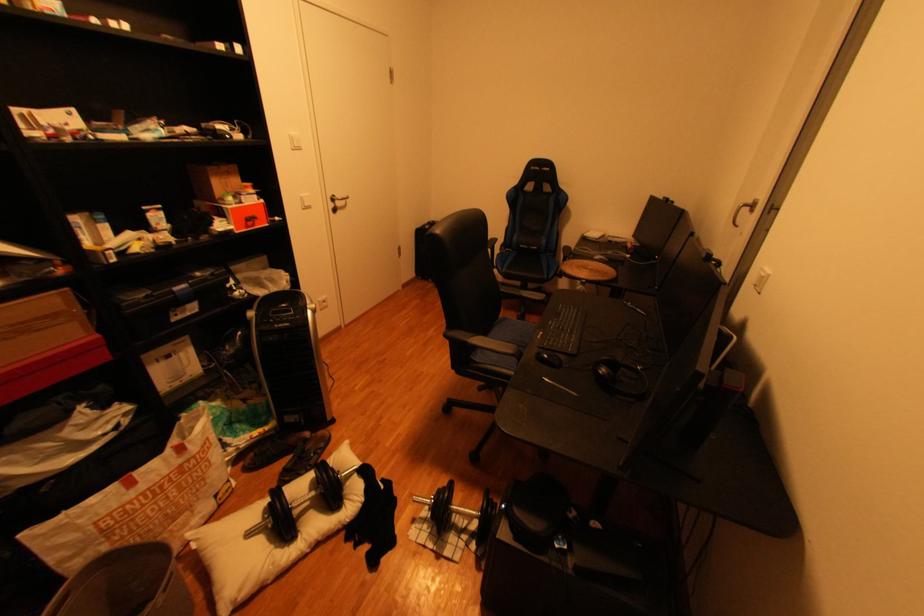
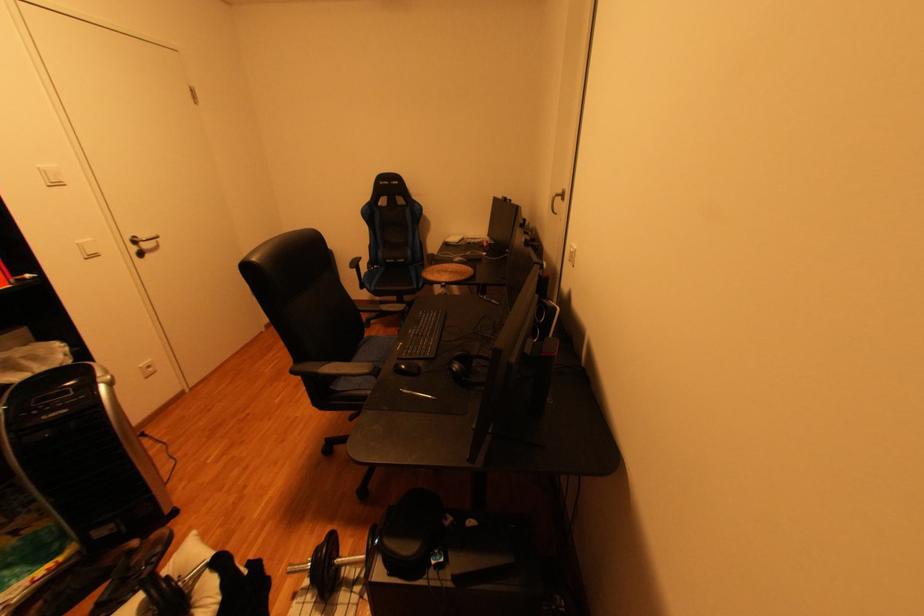
The point at (x=312, y=196) is marked in the first image. Where is the corresponding point in the second image?

(89, 243)